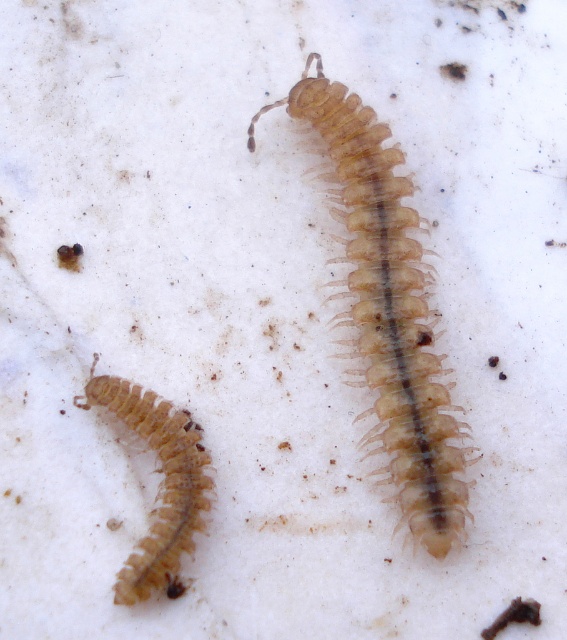
Is translucent beige centipede at center to the left of translucent beige centipede at lower left from the viewer's perspective?

Incorrect, translucent beige centipede at center is not on the left side of translucent beige centipede at lower left.

Which is below, translucent beige centipede at center or translucent beige centipede at lower left?

Positioned lower is translucent beige centipede at lower left.

The width and height of the screenshot is (567, 640). Find the location of `translucent beige centipede at center`. translucent beige centipede at center is located at coordinates (387, 307).